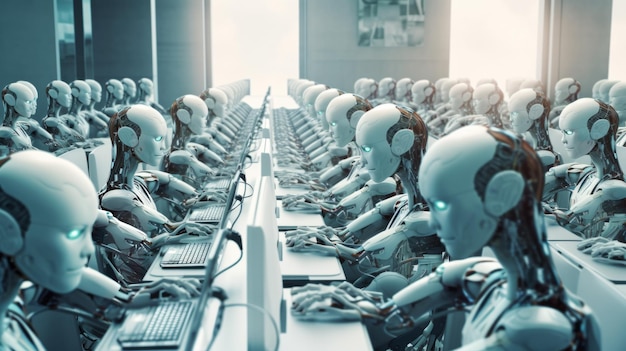
Find the location of a particular element. keyboards is located at coordinates (158, 329), (188, 258), (208, 213), (225, 182), (233, 166), (240, 151).